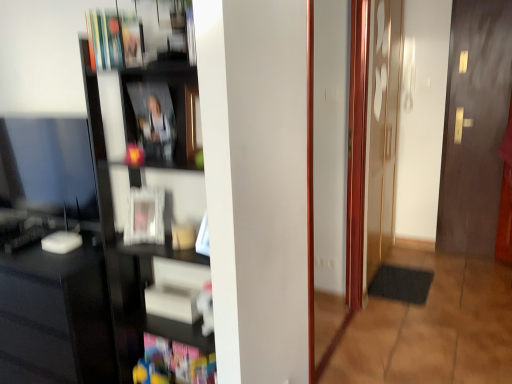
Where is `free space above black rubber mat at lower right (from a real-world perspective)`? This screenshot has width=512, height=384. free space above black rubber mat at lower right (from a real-world perspective) is located at coordinates (406, 274).